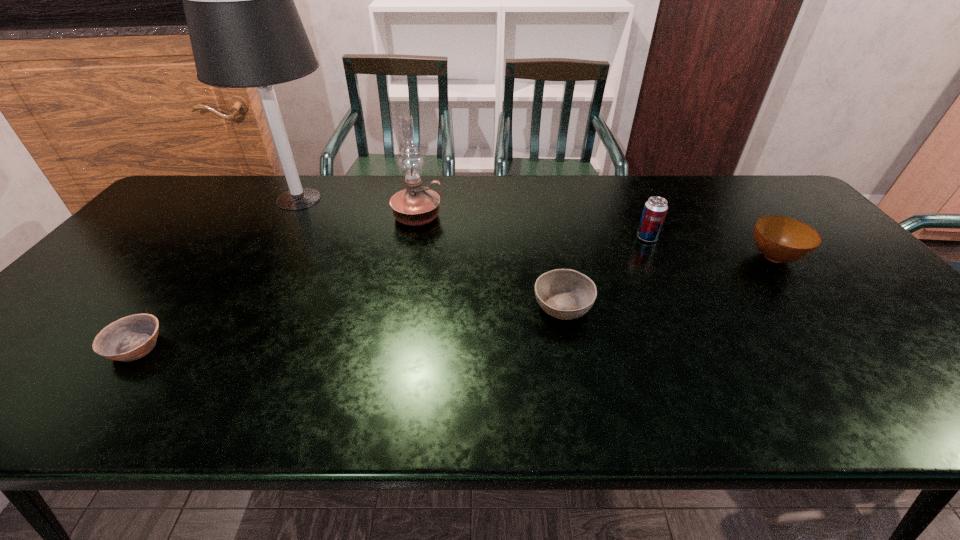
I want to click on table lamp, so click(245, 30).

Identify the location of the fourth object from right to left. This screenshot has height=540, width=960. (416, 205).

Locate an element on the screen. Image resolution: width=960 pixels, height=540 pixels. the fifth shortest object is located at coordinates (416, 205).

At what (x,y) coordinates should I click in order to perform the action: click on the fifth object from left to right. Please return your answer as a coordinate pair (x, y). Image resolution: width=960 pixels, height=540 pixels. Looking at the image, I should click on (655, 209).

The image size is (960, 540). In order to click on the fourth shortest object in this screenshot , I will do `click(655, 209)`.

Locate an element on the screen. This screenshot has width=960, height=540. the farthest bowl is located at coordinates (780, 239).

This screenshot has width=960, height=540. Find the location of `the rightmost bowl`. the rightmost bowl is located at coordinates (780, 239).

Where is `the fifth tallest object`? This screenshot has width=960, height=540. the fifth tallest object is located at coordinates (566, 294).

Identify the location of the second bowl from right to left. (566, 294).

Where is `the shortest object`? Image resolution: width=960 pixels, height=540 pixels. the shortest object is located at coordinates (x=132, y=337).